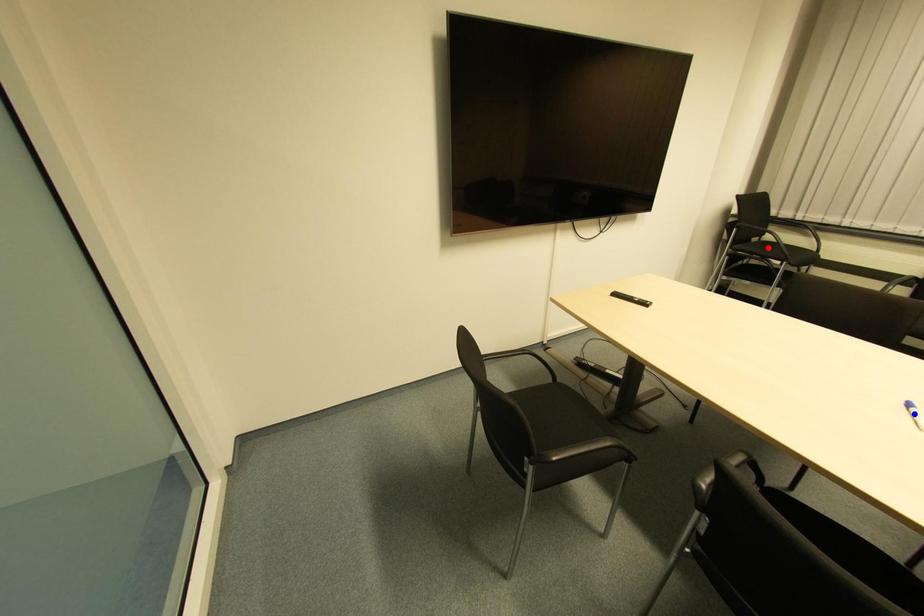
Question: Which of the two points in the image is closer to the camera?

Choices:
 (A) Blue point is closer.
 (B) Red point is closer.

Answer: (A)